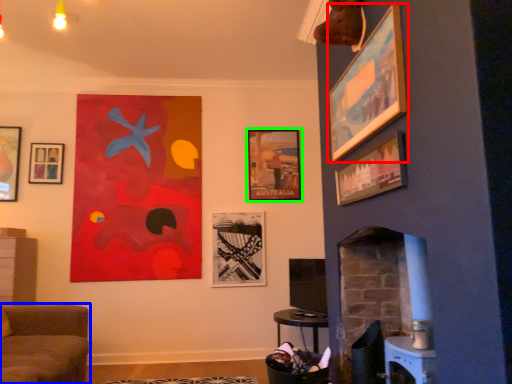
Question: Considering the real-world distances, which object is closest to picture frame (highlighted by a red box)? furniture (highlighted by a blue box) or picture frame (highlighted by a green box).

Choices:
 (A) furniture
 (B) picture frame

Answer: (B)